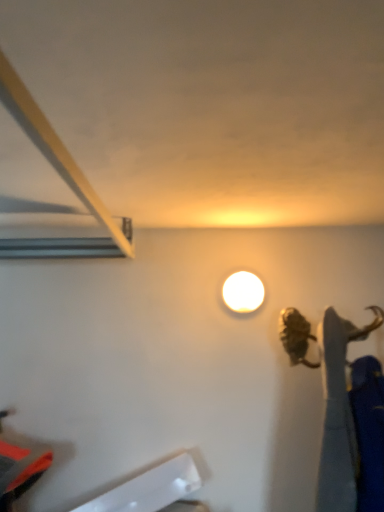
Question: Looking at the image, does white plastic ruler at lower left seem bigger or smaller compared to white glossy lamp at upper center?

Choices:
 (A) big
 (B) small

Answer: (A)

Question: In terms of height, does white plastic ruler at lower left look taller or shorter compared to white glossy lamp at upper center?

Choices:
 (A) short
 (B) tall

Answer: (B)

Question: Is point (157, 501) closer or farther from the camera than point (246, 306)?

Choices:
 (A) closer
 (B) farther

Answer: (A)

Question: Which is correct: white glossy lamp at upper center is inside white plastic ruler at lower left, or outside of it?

Choices:
 (A) outside
 (B) inside

Answer: (A)

Question: From their relative heights in the image, would you say white glossy lamp at upper center is taller or shorter than white plastic ruler at lower left?

Choices:
 (A) short
 (B) tall

Answer: (A)

Question: Looking at their shapes, would you say white glossy lamp at upper center is wider or thinner than white plastic ruler at lower left?

Choices:
 (A) wide
 (B) thin

Answer: (B)

Question: Is white glossy lamp at upper center in front of or behind white plastic ruler at lower left in the image?

Choices:
 (A) front
 (B) behind

Answer: (B)